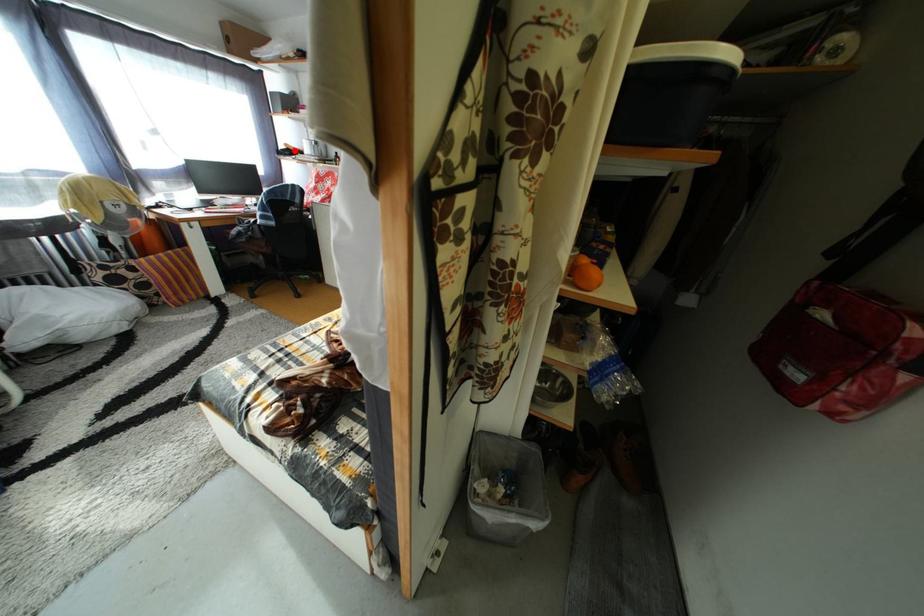
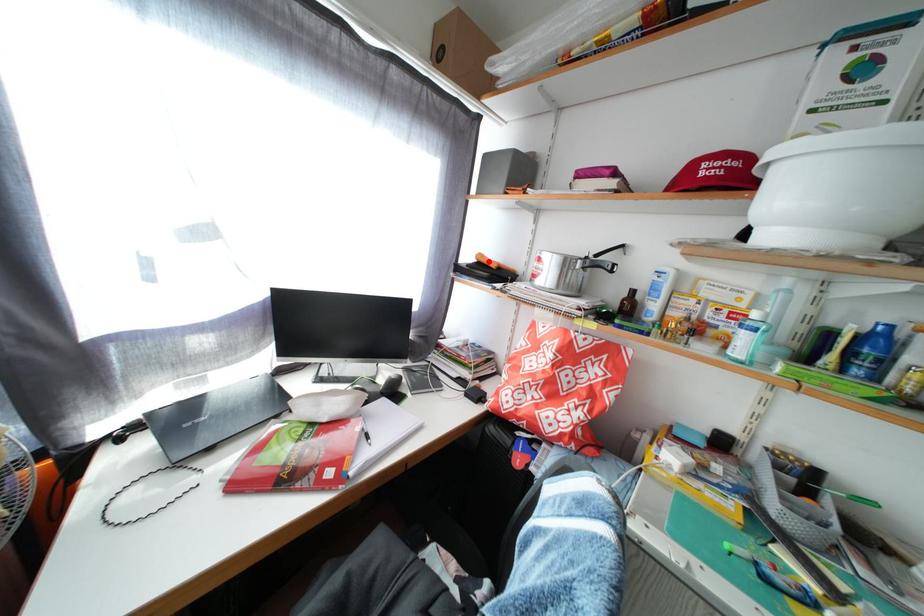
I am providing you with two images of the same scene from different viewpoints. A red point is marked on the first image and another point is marked on the second image. Does the point marked in image1 correspond to the same location as the one in image2?

Yes